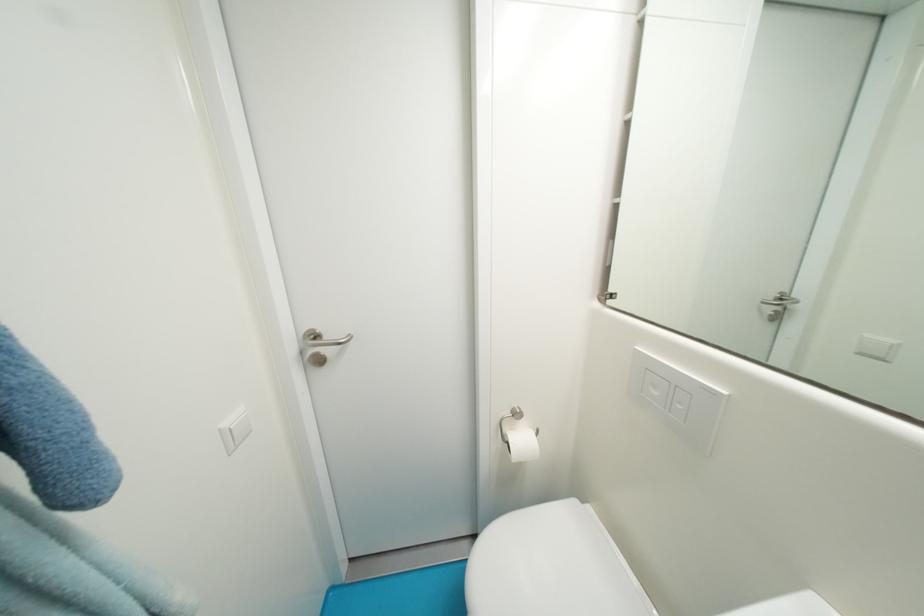
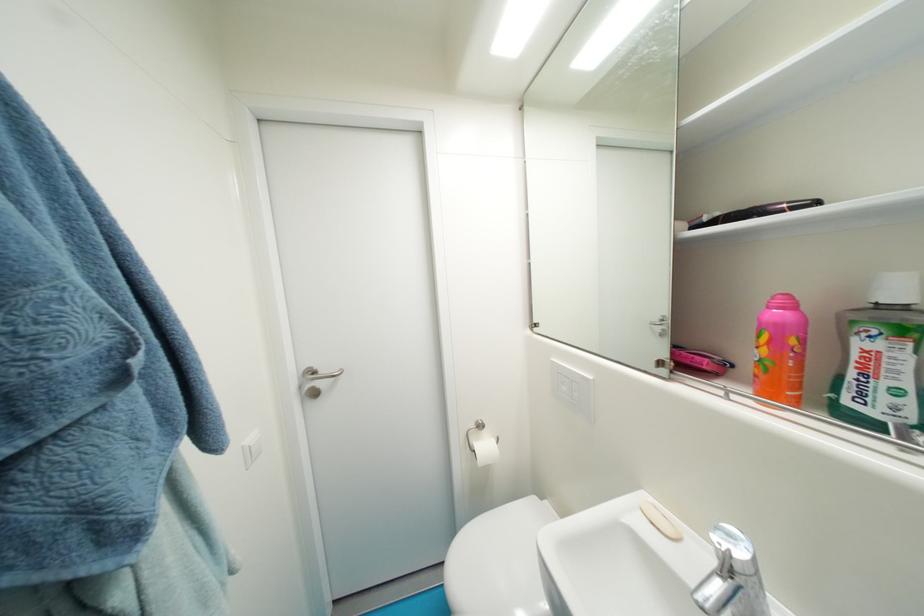
In the second image, find the point that corresponds to (x=662, y=395) in the first image.

(570, 390)